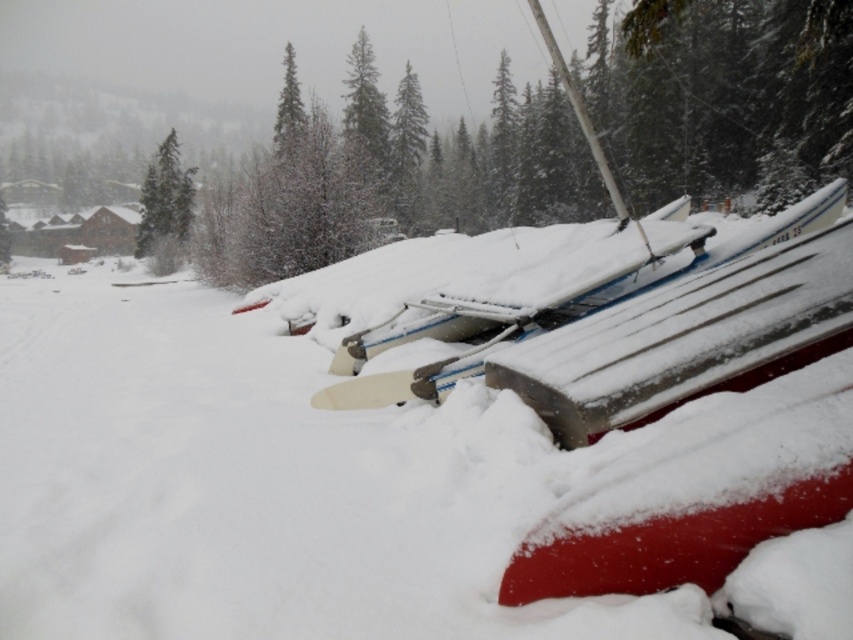
You are an observer standing in the snowy landscape. You notice the white fluffy snow at center and the green matte tree at upper left. Which object is taller?

The green matte tree at upper left is taller than the white fluffy snow at center.

You are planning to build a snowman in the snowy landscape. You see the white fluffy snow at center and the green matte tree at upper left. Which location would be more suitable for building the snowman?

The white fluffy snow at center is more suitable for building the snowman because it is positioned under the green matte tree at upper left, providing a stable base and aesthetic contrast against the tree.